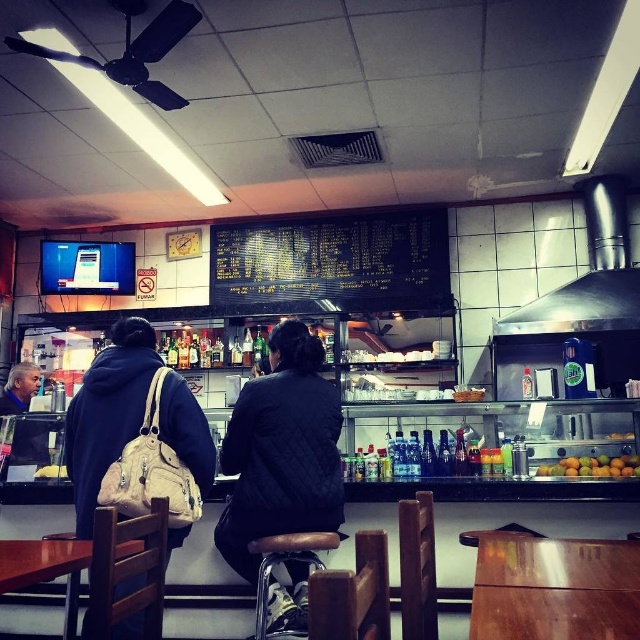
Question: Considering the real-world distances, which object is closest to the brown wooden table at lower left?

Choices:
 (A) stainless steel exhaust hood at upper right
 (B) black quilted jacket at center
 (C) dark blue quilted jacket at center

Answer: (C)

Question: Which point is farther to the camera?

Choices:
 (A) (177, 422)
 (B) (289, 305)

Answer: (B)

Question: In this image, where is brown leather bar stool at lower center located relative to orange matte fruit at lower right?

Choices:
 (A) above
 (B) below

Answer: (B)

Question: Can you confirm if brown leather bar stool at lower center is smaller than yellow plastic bag at lower left?

Choices:
 (A) no
 (B) yes

Answer: (A)

Question: Can you confirm if black quilted jacket at center is wider than brown wooden table at lower left?

Choices:
 (A) yes
 (B) no

Answer: (A)

Question: Which point appears farthest from the camera in this image?

Choices:
 (A) (17, 550)
 (B) (296, 259)
 (C) (54, 468)

Answer: (B)